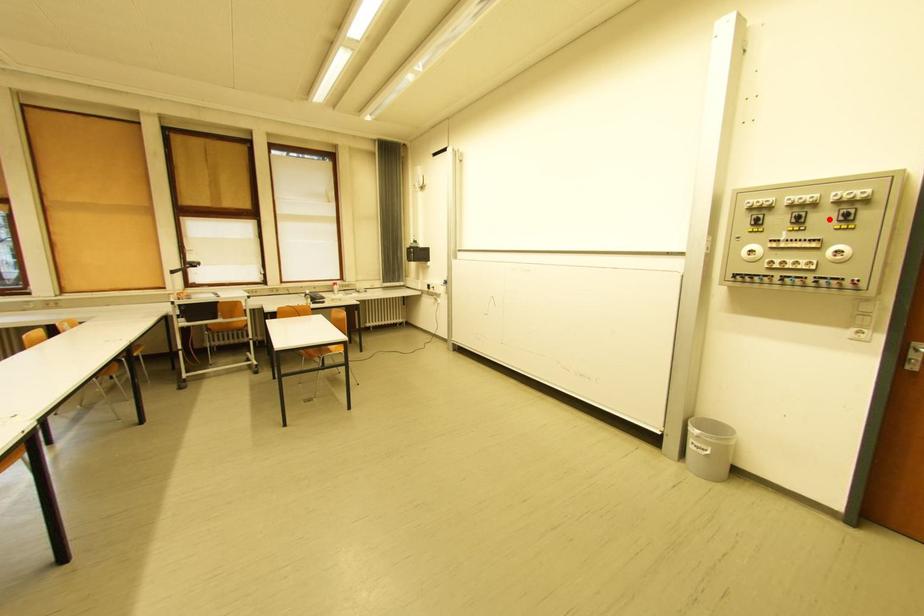
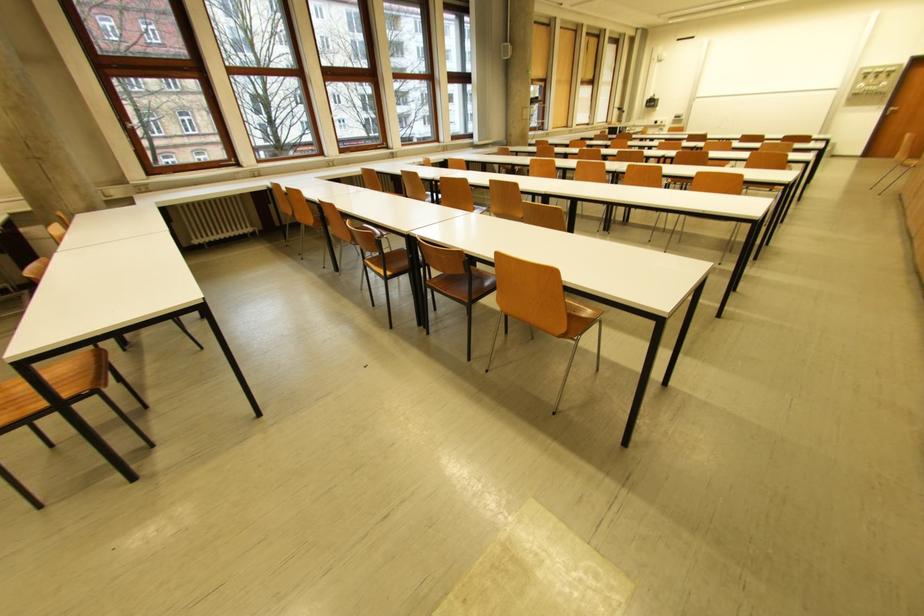
The point at the highlighted location is marked in the first image. Where is the corresponding point in the second image?

(890, 77)